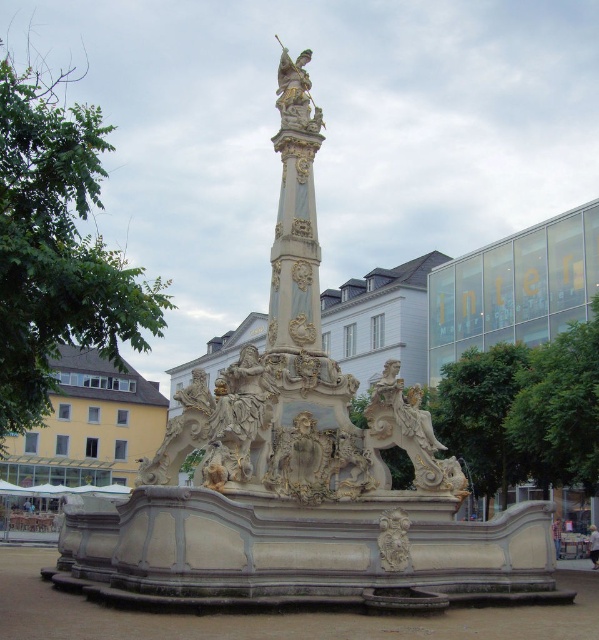
You are an art student analyzing the fountain. You observe the gold ornate statue at center and the carved stone relief at center. Which object is positioned to the left of the other?

The gold ornate statue at center is to the left of carved stone relief at center.

You are an art student analyzing the fountain structure. You observe the gold ornate statue at center and the carved stone relief at center. Which object is located higher in the scene?

The gold ornate statue at center is positioned over the carved stone relief at center, so it is higher in the scene.

You are an art student visiting the fountain and want to sketch both the gold ornate statue at center and the carved stone relief at center. Which one should you focus on first if you want to capture the most prominent feature?

The gold ornate statue at center is larger in size than the carved stone relief at center, so you should focus on the gold ornate statue at center first as it is the more prominent feature.